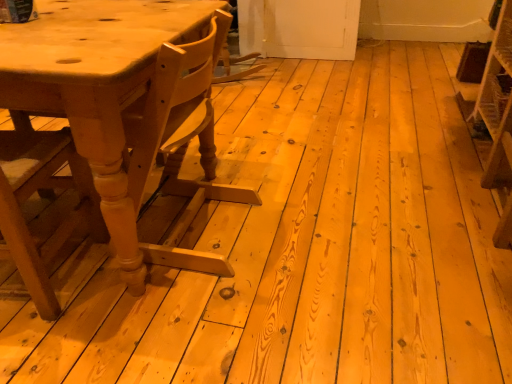
In order to click on light brown wood table at left in this screenshot , I will do `click(97, 87)`.

Locate an element on the screen. wooden chair at left is located at coordinates (46, 198).

Is wooden crate at right taller than light brown wood table at left?

No, wooden crate at right is not taller than light brown wood table at left.

Which is in front, point (497, 121) or point (139, 4)?

The point (139, 4) is closer to the camera.

From the image's perspective, is wooden crate at right located beneath light brown wood table at left?

No.

Considering the sizes of wooden crate at right and light brown wood table at left in the image, is wooden crate at right bigger or smaller than light brown wood table at left?

In the image, wooden crate at right appears to be smaller than light brown wood table at left.

Can you tell me how much light brown wood table at left and wooden crate at right differ in facing direction?

91 degrees separate the facing orientations of light brown wood table at left and wooden crate at right.

Does light brown wood table at left have a greater height compared to wooden crate at right?

Yes, light brown wood table at left is taller than wooden crate at right.

From a real-world perspective, is light brown wood table at left positioned above or below wooden crate at right?

light brown wood table at left is above wooden crate at right.

From the image's perspective, is light brown wood table at left over wooden crate at right?

Incorrect, from the image's perspective, light brown wood table at left is lower than wooden crate at right.

Does wooden chair at left have a lesser width compared to wooden crate at right?

No.

From a real-world perspective, is wooden chair at left located higher than wooden crate at right?

Indeed, from a real-world perspective, wooden chair at left stands above wooden crate at right.

Are wooden chair at left and wooden crate at right located far from each other?

Yes, wooden chair at left and wooden crate at right are quite far apart.

From the image's perspective, relative to wooden crate at right, is wooden chair at left above or below?

Based on their image positions, wooden chair at left is located beneath wooden crate at right.

Is light brown wood table at left in front of or behind wooden chair at left in the image?

Visually, light brown wood table at left is located behind wooden chair at left.

Can you see light brown wood table at left touching wooden chair at left?

No, light brown wood table at left is not next to wooden chair at left.

How far apart are light brown wood table at left and wooden chair at left?

A distance of 33.14 centimeters exists between light brown wood table at left and wooden chair at left.

Can you confirm if light brown wood table at left is shorter than wooden chair at left?

Yes, light brown wood table at left is shorter than wooden chair at left.

Considering the sizes of wooden chair at left and light brown wood table at left in the image, is wooden chair at left wider or thinner than light brown wood table at left?

wooden chair at left is thinner than light brown wood table at left.

From a real-world perspective, is wooden chair at left positioned over light brown wood table at left based on gravity?

Indeed, from a real-world perspective, wooden chair at left stands above light brown wood table at left.

What are the coordinates of `chair that appears in front of the light brown wood table at left` in the screenshot? It's located at (46, 198).

Is light brown wood table at left inside wooden chair at left?

No, light brown wood table at left is not surrounded by wooden chair at left.

Is wooden crate at right in front of wooden chair at left?

No.

Would you say wooden crate at right is outside wooden chair at left?

Yes, wooden crate at right is not within wooden chair at left.

Is wooden crate at right oriented away from wooden chair at left?

wooden crate at right does not have its back to wooden chair at left.

Is wooden crate at right at the left side of wooden chair at left?

No, wooden crate at right is not to the left of wooden chair at left.

Find the location of a particular element. The image size is (512, 384). shelf that appears above the light brown wood table at left (from the image's perspective) is located at coordinates (496, 118).

This screenshot has height=384, width=512. In order to click on shelf behind the light brown wood table at left in this screenshot , I will do `click(496, 118)`.

Based on the photo, looking at the image, which one is located closer to light brown wood table at left, wooden crate at right or wooden chair at left?

wooden chair at left lies closer to light brown wood table at left than the other object.

When comparing their distances from light brown wood table at left, does wooden chair at left or wooden crate at right seem closer?

wooden chair at left.

When comparing their distances from wooden crate at right, does light brown wood table at left or wooden chair at left seem further?

wooden chair at left is further to wooden crate at right.

Based on their spatial positions, is wooden chair at left or light brown wood table at left closer to wooden crate at right?

Among the two, light brown wood table at left is located nearer to wooden crate at right.

Based on their spatial positions, is wooden crate at right or light brown wood table at left closer to wooden chair at left?

The object closer to wooden chair at left is light brown wood table at left.

Estimate the real-world distances between objects in this image. Which object is further from wooden chair at left, light brown wood table at left or wooden crate at right?

Based on the image, wooden crate at right appears to be further to wooden chair at left.

Locate an element on the screen. table between wooden chair at left and wooden crate at right in the horizontal direction is located at coordinates (97, 87).